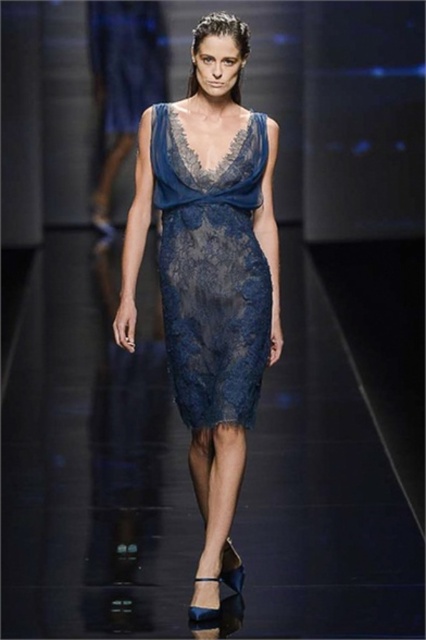
In the scene shown: You are a photographer at the runway show. You want to capture a photo of the lace dress at center and the lace fabric dress at center. Which one is closer to the camera?

The lace dress at center is positioned under the lace fabric dress at center, so the lace fabric dress at center is closer to the camera.

You are a photographer positioned at the front of the runway. You want to capture a closeup shot of the model wearing the navy lace dress at center. Based on your position, will the point marked at coordinates (210, 275) be within your camera frame?

The point marked at coordinates (210, 275) is where the navy lace dress at center is located. Since you are positioned at the front of the runway, this point would be directly in front of you and within your camera frame.